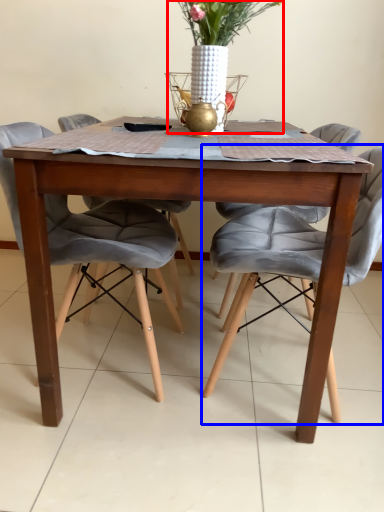
Question: Which object appears closest to the camera in this image, floral arrangement (highlighted by a red box) or chair (highlighted by a blue box)?

Choices:
 (A) floral arrangement
 (B) chair

Answer: (B)